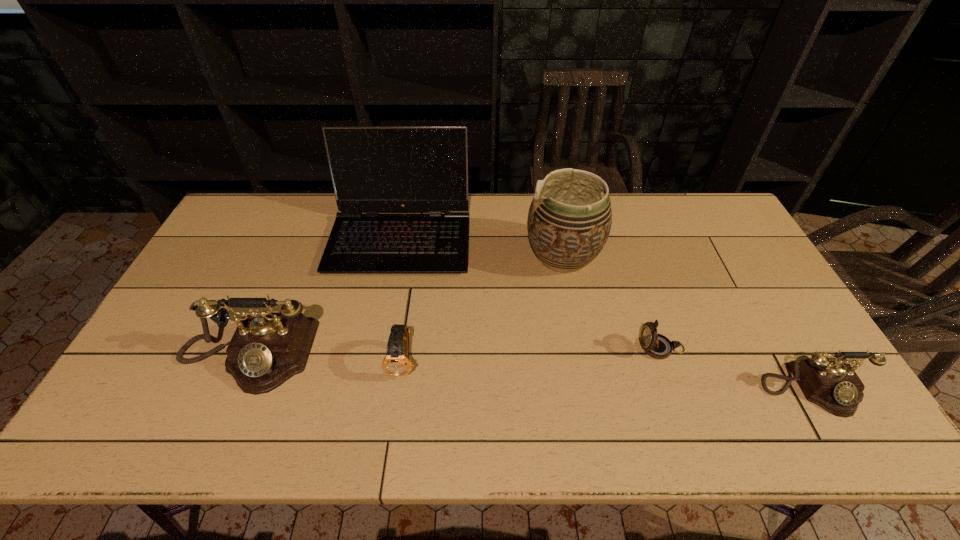
Identify the location of the taller telephone. Image resolution: width=960 pixels, height=540 pixels. (268, 348).

Locate an element on the screen. This screenshot has width=960, height=540. the left telephone is located at coordinates pyautogui.click(x=268, y=348).

Locate an element on the screen. the rightmost object is located at coordinates (831, 383).

In order to click on the shorter telephone in this screenshot , I will do `click(831, 383)`.

Identify the location of pottery. (569, 221).

Locate an element on the screen. This screenshot has width=960, height=540. laptop computer is located at coordinates (374, 169).

At what (x,y) coordinates should I click in order to perform the action: click on the second object from right to left. Please return your answer as a coordinate pair (x, y). The width and height of the screenshot is (960, 540). Looking at the image, I should click on (658, 346).

Locate an element on the screen. This screenshot has height=540, width=960. watch is located at coordinates (396, 362).

Locate an element on the screen. Image resolution: width=960 pixels, height=540 pixels. vacant space located 0.220m on the left of the fourth object from left to right is located at coordinates (455, 256).

Where is `vacant space located on the screen of the laptop computer`? Image resolution: width=960 pixels, height=540 pixels. vacant space located on the screen of the laptop computer is located at coordinates (385, 318).